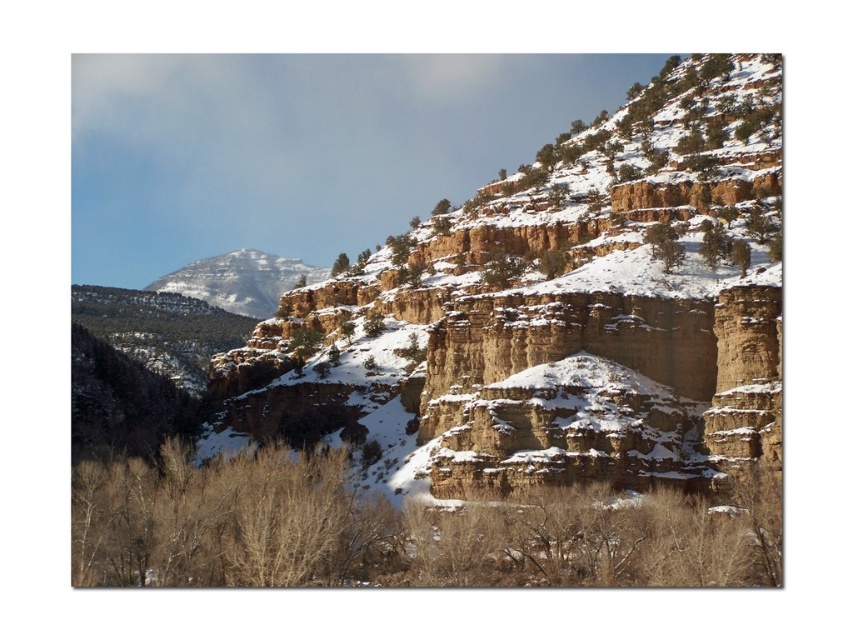
Is rustic stone cliff at center above green leafy shrub at upper center?

Correct, rustic stone cliff at center is located above green leafy shrub at upper center.

Is point (444, 548) farther from viewer compared to point (657, 228)?

That is False.

Who is more distant from viewer, (666, 438) or (660, 243)?

The point (660, 243) is behind.

The width and height of the screenshot is (853, 640). What are the coordinates of `rustic stone cliff at center` in the screenshot? It's located at (491, 381).

Does rustic stone cliff at center lie behind green matte tree at upper center?

No, rustic stone cliff at center is closer to the viewer.

Between rustic stone cliff at center and green matte tree at upper center, which one appears on the left side from the viewer's perspective?

Positioned to the left is green matte tree at upper center.

Is point (653, 496) less distant than point (344, 269)?

Yes, it is.

The width and height of the screenshot is (853, 640). I want to click on rustic stone cliff at center, so click(491, 381).

Between green leafy shrub at upper center and green matte tree at upper center, which one has more height?

Standing taller between the two is green matte tree at upper center.

Which is behind, point (660, 253) or point (347, 266)?

Positioned behind is point (347, 266).

Image resolution: width=853 pixels, height=640 pixels. Identify the location of green leafy shrub at upper center. (664, 244).